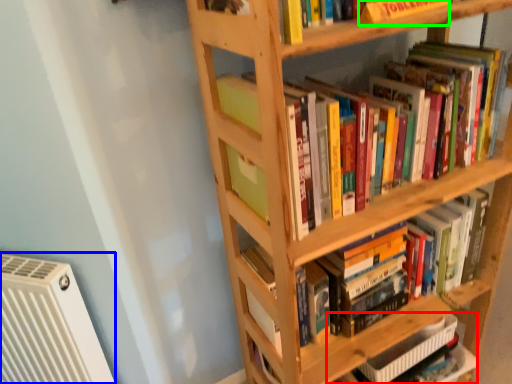
Question: Based on their relative distances, which object is farther from book (highlighted by a red box)? Choose from air conditioning (highlighted by a blue box) and paperback book (highlighted by a green box).

Choices:
 (A) air conditioning
 (B) paperback book

Answer: (B)